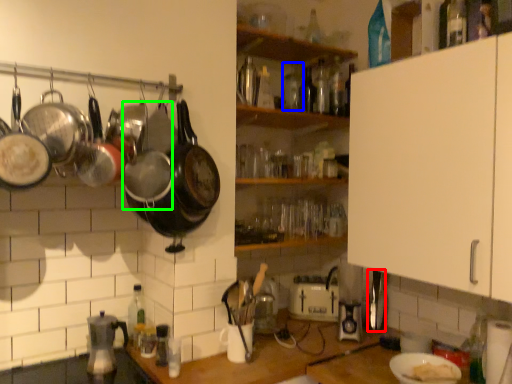
Question: Based on their relative distances, which object is farther from appliance (highlighted by a red box)? Choose from bottle (highlighted by a blue box) and wok (highlighted by a green box).

Choices:
 (A) bottle
 (B) wok

Answer: (B)